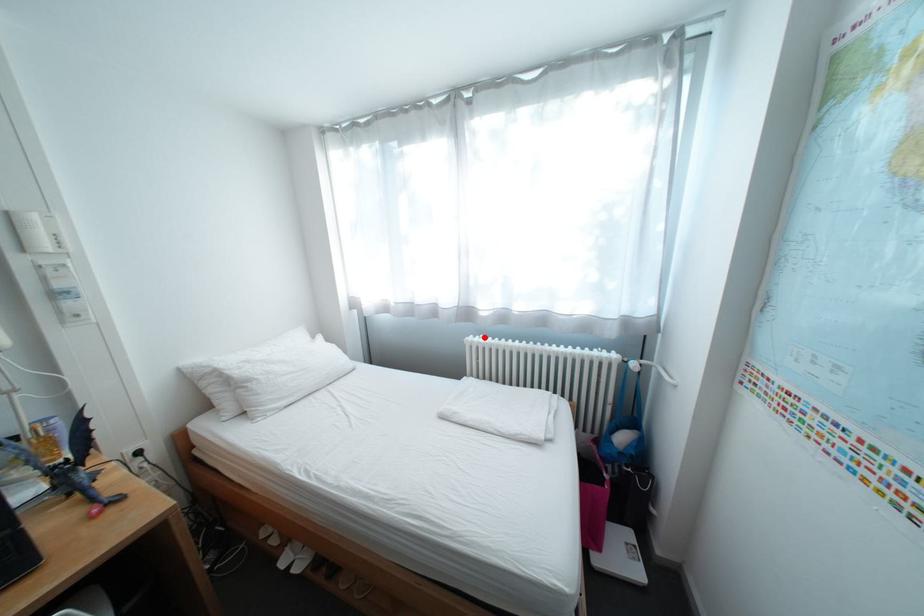
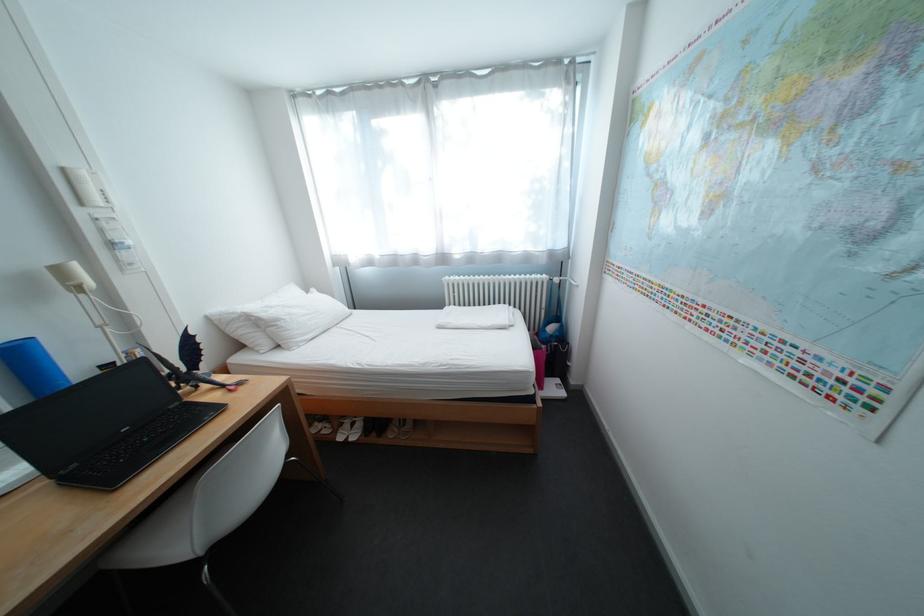
Question: I am providing you with two images of the same scene from different viewpoints. A red point is marked on the first image. Is the red point's position out of view in image 2?

Choices:
 (A) Yes
 (B) No

Answer: (B)